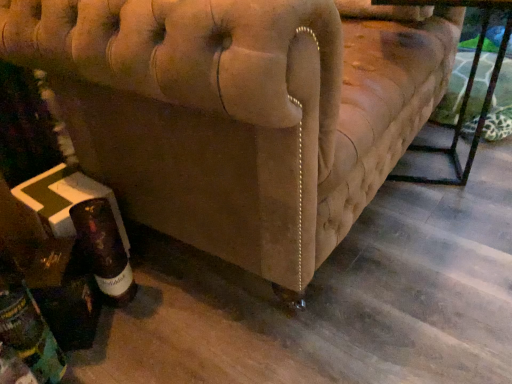
Question: Is dark brown glass bottle at lower left, which is the second bottle from right to left, not within beige fabric couch at lower left?

Choices:
 (A) yes
 (B) no

Answer: (A)

Question: Is beige fabric couch at lower left a part of dark brown glass bottle at lower left, which is the second bottle from right to left?

Choices:
 (A) no
 (B) yes

Answer: (A)

Question: Is dark brown glass bottle at lower left, the first bottle from the left, not close to beige fabric couch at lower left?

Choices:
 (A) no
 (B) yes

Answer: (A)

Question: Considering the relative sizes of dark brown glass bottle at lower left, which is the second bottle from right to left, and beige fabric couch at lower left in the image provided, is dark brown glass bottle at lower left, which is the second bottle from right to left, shorter than beige fabric couch at lower left?

Choices:
 (A) no
 (B) yes

Answer: (B)

Question: Is dark brown glass bottle at lower left, which is the second bottle from right to left, aimed at beige fabric couch at lower left?

Choices:
 (A) no
 (B) yes

Answer: (A)

Question: Is dark brown glass bottle at lower left, the first bottle from the left, positioned with its back to beige fabric couch at lower left?

Choices:
 (A) no
 (B) yes

Answer: (A)

Question: From the image's perspective, is metallic black table at lower right on beige fabric couch at lower left?

Choices:
 (A) no
 (B) yes

Answer: (A)

Question: Can beige fabric couch at lower left be found inside metallic black table at lower right?

Choices:
 (A) yes
 (B) no

Answer: (B)

Question: Can you confirm if metallic black table at lower right is shorter than beige fabric couch at lower left?

Choices:
 (A) no
 (B) yes

Answer: (B)

Question: Could you tell me if metallic black table at lower right is facing beige fabric couch at lower left?

Choices:
 (A) no
 (B) yes

Answer: (B)

Question: From a real-world perspective, is metallic black table at lower right positioned under beige fabric couch at lower left based on gravity?

Choices:
 (A) no
 (B) yes

Answer: (B)

Question: Does metallic black table at lower right have a greater width compared to beige fabric couch at lower left?

Choices:
 (A) no
 (B) yes

Answer: (A)

Question: Is brown glass bottle at lower left, placed as the 1th bottle when sorted from right to left, wider than metallic black table at lower right?

Choices:
 (A) yes
 (B) no

Answer: (B)